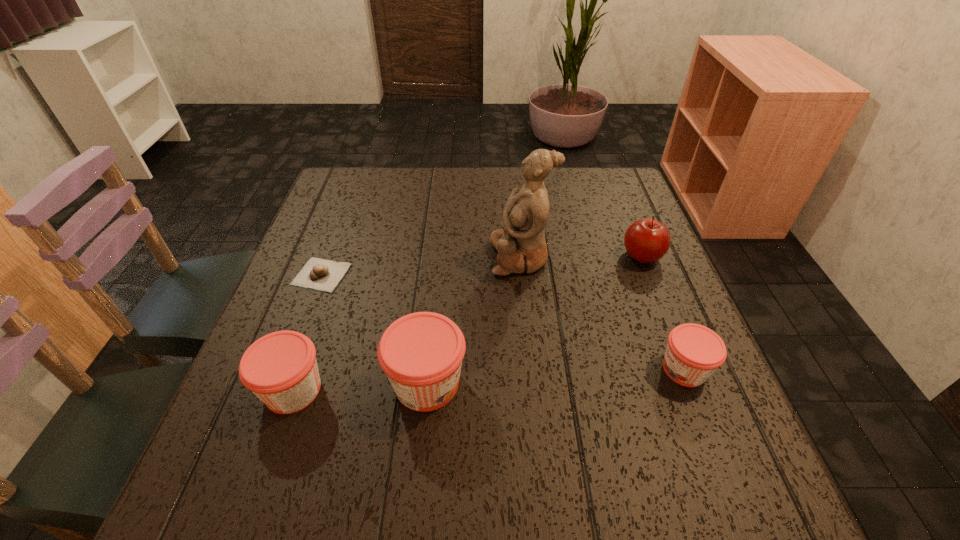
Locate an element on the screen. Image resolution: width=960 pixels, height=540 pixels. free spot located on the front label of the rightmost jam is located at coordinates (507, 369).

The image size is (960, 540). Find the location of `free space located 0.130m on the front label of the rightmost jam`. free space located 0.130m on the front label of the rightmost jam is located at coordinates (590, 369).

The image size is (960, 540). Identify the location of vacant region located 0.400m on the front label of the rightmost jam. (449, 369).

At what (x,y) coordinates should I click in order to perform the action: click on vacant space situated 0.250m on the back of the apple. Please return your answer as a coordinate pair (x, y). Looking at the image, I should click on (615, 188).

Locate an element on the screen. free space located 0.070m on the right of the garlic is located at coordinates (379, 275).

Find the location of a particular element. The height and width of the screenshot is (540, 960). free region located on the front-facing side of the tallest object is located at coordinates (433, 257).

Locate an element on the screen. vacant space located on the front-facing side of the tallest object is located at coordinates (416, 257).

This screenshot has height=540, width=960. What are the coordinates of `blank space located 0.230m on the front-facing side of the tallest object` in the screenshot? It's located at (396, 257).

You are a GUI agent. You are given a task and a screenshot of the screen. Output one action in this format:
    pyautogui.click(x=<x>, y=<y>)
    Task: Click on the jam that is at the left edge
    This screenshot has width=960, height=540.
    Given the screenshot: What is the action you would take?
    pyautogui.click(x=280, y=368)

Identify the location of garlic at the left edge. The height and width of the screenshot is (540, 960). (317, 274).